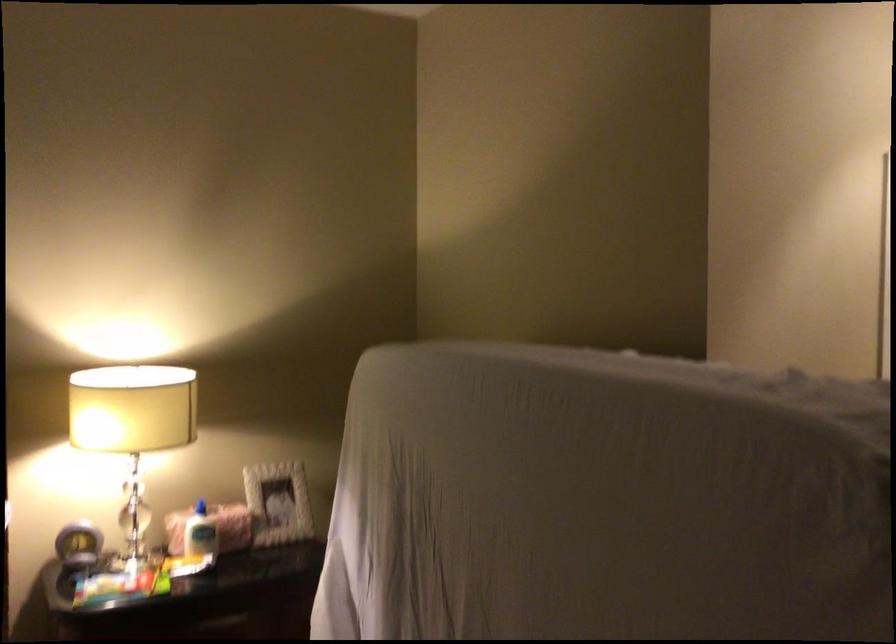
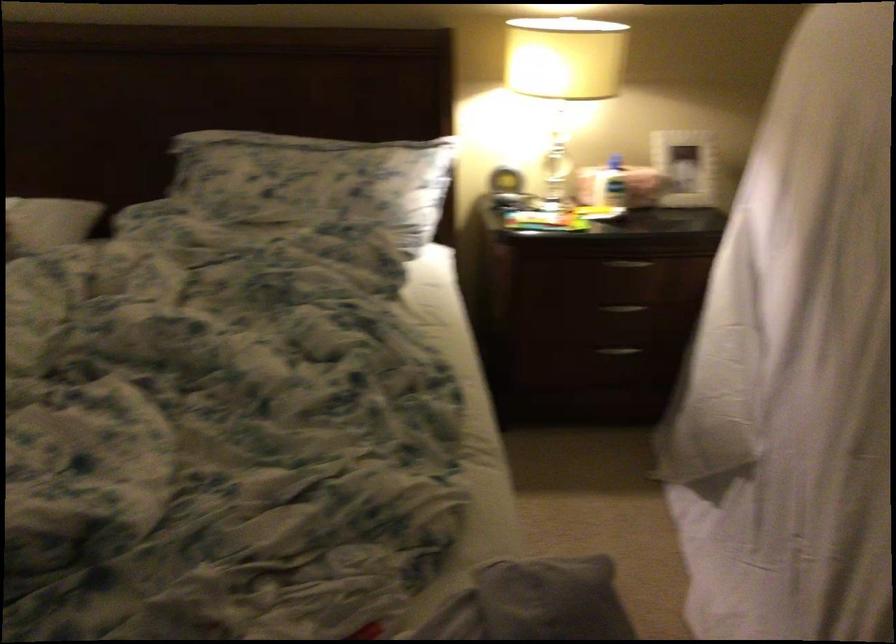
First-person continuous shooting, in which direction is the camera rotating?

The rotation direction of the camera is left-down.